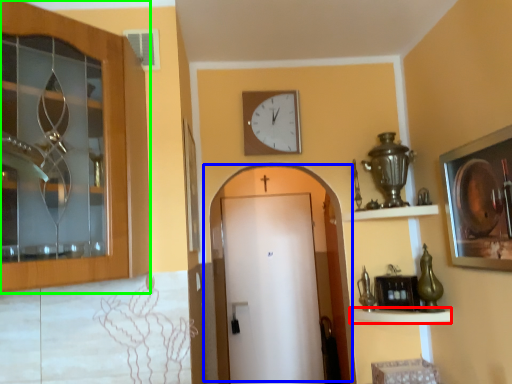
Question: Which is farther away from shelf (highlighted by a red box)? door (highlighted by a blue box) or door (highlighted by a green box)?

Choices:
 (A) door
 (B) door

Answer: (A)